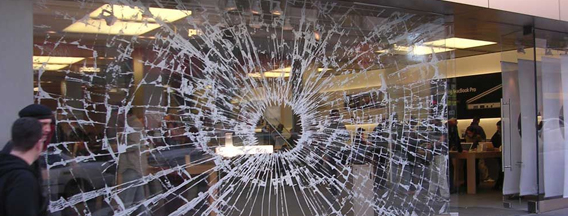
Find the location of a particular element. Image resolution: width=568 pixels, height=216 pixels. ceiling light is located at coordinates (457, 42), (424, 52), (292, 70), (275, 75), (146, 16), (133, 29), (53, 58), (52, 64).